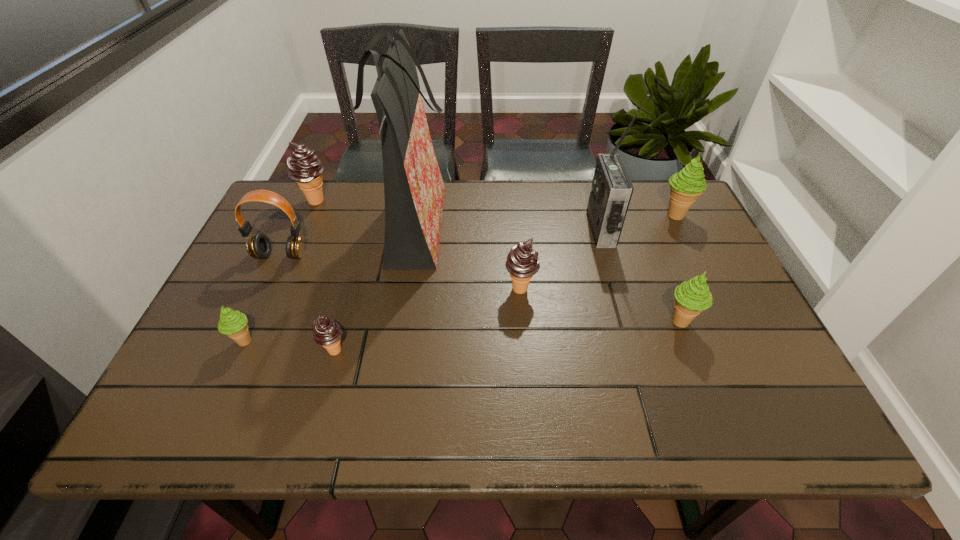
You are a GUI agent. You are given a task and a screenshot of the screen. Output one action in this format:
    pyautogui.click(x=<x>, y=<y>)
    Task: Click on the chocolate icecream that is the second closest one to the shopping bag
    This screenshot has width=960, height=540.
    Given the screenshot: What is the action you would take?
    pyautogui.click(x=304, y=166)

The width and height of the screenshot is (960, 540). I want to click on the closest green icecream to the third icecream from left to right, so click(x=232, y=323).

Identify which green icecream is the third nearest to the leftmost chocolate icecream. Please provide its 2D coordinates. Your answer should be formatted as a tuple, i.e. [(x, y)], where the tuple contains the x and y coordinates of a point satisfying the conditions above.

[(686, 185)]

What are the coordinates of `free point that satisfies the following two spatial constraints: 1. on the ear cups of the headset; 2. on the left side of the third icecream from left to right` in the screenshot? It's located at (237, 351).

Identify the location of vacant area that satisfies the following two spatial constraints: 1. on the front side of the shopping bag; 2. on the ear cups of the brown headset. (409, 255).

The height and width of the screenshot is (540, 960). Identify the location of vacant region that satisfies the following two spatial constraints: 1. on the front side of the biggest green icecream; 2. on the left side of the biggest chocolate icecream. (310, 215).